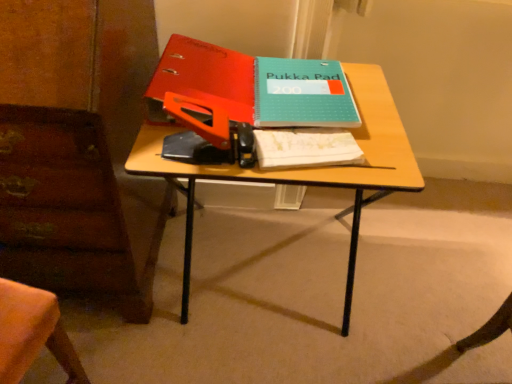
Question: Which direction should I rotate to look at matte orange binder at upper center, the 2th paperback book viewed from the right?

Choices:
 (A) right
 (B) left

Answer: (B)

Question: Is matte orange binder at upper center, the 2th paperback book viewed from the right, not close to white paper notebook at center?

Choices:
 (A) yes
 (B) no

Answer: (B)

Question: Is matte orange binder at upper center, which appears as the 1th paperback book when viewed from the left, behind white paper notebook at center?

Choices:
 (A) no
 (B) yes

Answer: (B)

Question: From the image's perspective, does matte orange binder at upper center, the 2th paperback book viewed from the right, appear lower than white paper notebook at center?

Choices:
 (A) yes
 (B) no

Answer: (B)

Question: Does matte orange binder at upper center, the 2th paperback book viewed from the right, have a greater width compared to white paper notebook at center?

Choices:
 (A) yes
 (B) no

Answer: (A)

Question: Is matte orange binder at upper center, which appears as the 1th paperback book when viewed from the left, completely or partially outside of white paper notebook at center?

Choices:
 (A) no
 (B) yes

Answer: (B)

Question: From a real-world perspective, is matte orange binder at upper center, which appears as the 1th paperback book when viewed from the left, located beneath white paper notebook at center?

Choices:
 (A) yes
 (B) no

Answer: (B)

Question: Does wooden desk at center have a lesser height compared to matte orange binder at upper center, the 2th paperback book viewed from the right?

Choices:
 (A) yes
 (B) no

Answer: (B)

Question: Are wooden desk at center and matte orange binder at upper center, which appears as the 1th paperback book when viewed from the left, making contact?

Choices:
 (A) no
 (B) yes

Answer: (A)

Question: Is wooden desk at center smaller than matte orange binder at upper center, which appears as the 1th paperback book when viewed from the left?

Choices:
 (A) yes
 (B) no

Answer: (B)

Question: Does wooden desk at center come in front of matte orange binder at upper center, the 2th paperback book viewed from the right?

Choices:
 (A) yes
 (B) no

Answer: (A)

Question: From the image's perspective, is wooden desk at center on top of matte orange binder at upper center, the 2th paperback book viewed from the right?

Choices:
 (A) no
 (B) yes

Answer: (A)

Question: Is matte orange binder at upper center, the 2th paperback book viewed from the right, located within wooden desk at center?

Choices:
 (A) no
 (B) yes

Answer: (B)

Question: Does wooden desk at center appear on the left side of white paper notebook at center?

Choices:
 (A) yes
 (B) no

Answer: (A)